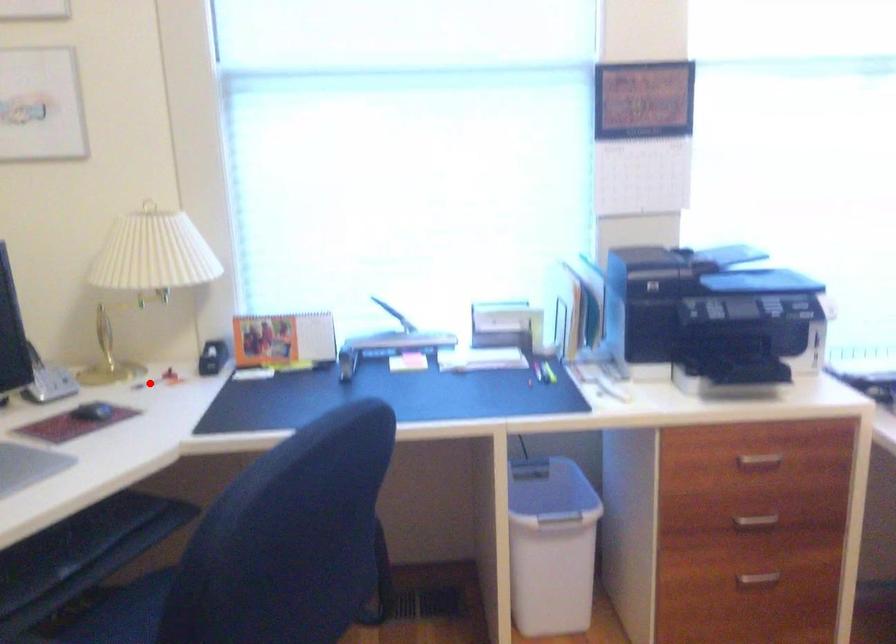
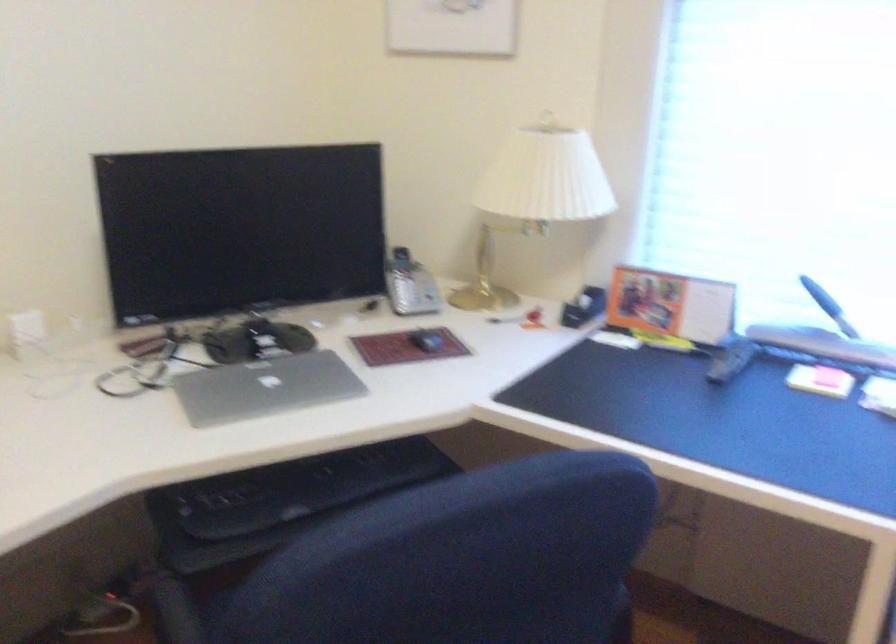
Question: I am providing you with two images of the same scene from different viewpoints. In image1, a red point is highlighted. Considering the same 3D point in image2, which of the following is correct?

Choices:
 (A) It is closer
 (B) It is farther

Answer: (A)